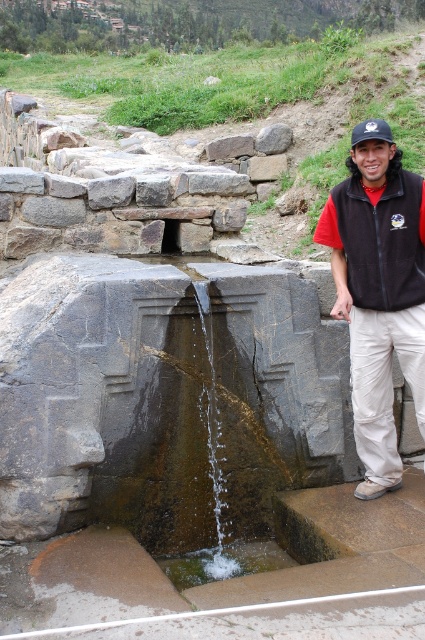
Question: Is clear water at center above gray rough rock at center?

Choices:
 (A) yes
 (B) no

Answer: (B)

Question: Estimate the real-world distances between objects in this image. Which object is closer to the clear water at center?

Choices:
 (A) black fleece vest at right
 (B) gray rough stone at center

Answer: (A)

Question: Among these objects, which one is farthest from the camera?

Choices:
 (A) clear water at center
 (B) black fleece vest at center

Answer: (A)

Question: Can you confirm if gray rough rock at center is positioned above black fabric baseball cap at upper right?

Choices:
 (A) yes
 (B) no

Answer: (A)

Question: Among these objects, which one is nearest to the camera?

Choices:
 (A) gray rough rock at center
 (B) clear water at center
 (C) gray rough stone at center

Answer: (B)

Question: Is black fleece vest at center above gray rough stone at center?

Choices:
 (A) yes
 (B) no

Answer: (B)